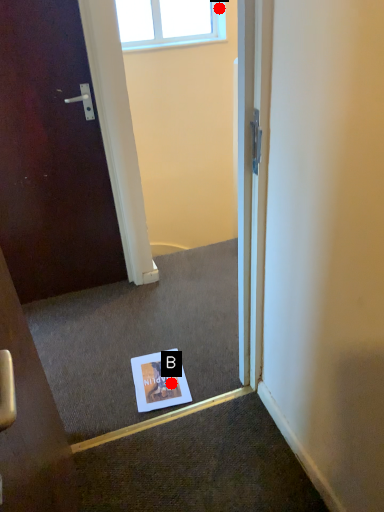
Question: Two points are circled on the image, labeled by A and B beside each circle. Which point appears closest to the camera in this image?

Choices:
 (A) A is closer
 (B) B is closer

Answer: (B)